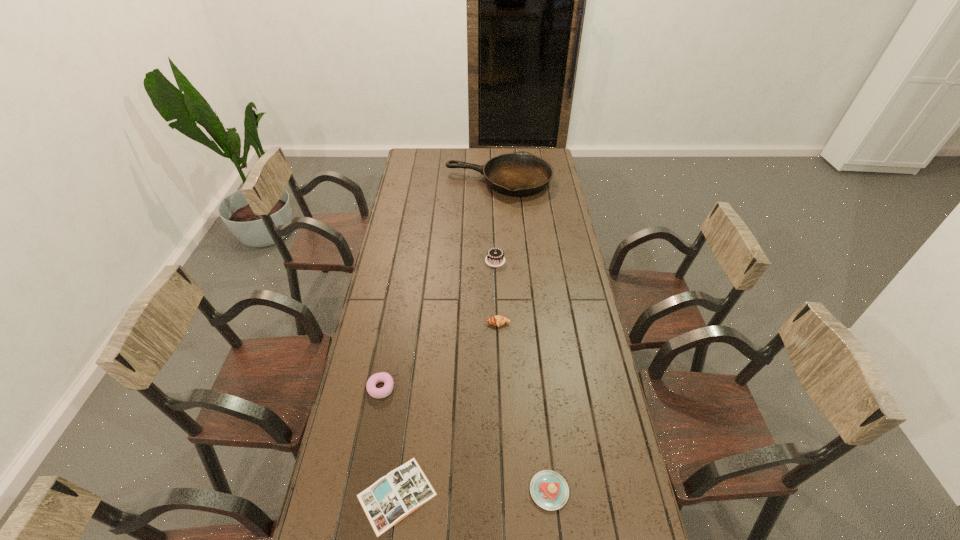
This screenshot has width=960, height=540. Find the location of `the farthest object`. the farthest object is located at coordinates (519, 174).

This screenshot has width=960, height=540. I want to click on the fifth nearest object, so click(x=495, y=257).

Locate an element on the screen. the second pastry from left to right is located at coordinates (497, 320).

You are a GUI agent. You are given a task and a screenshot of the screen. Output one action in this format:
    pyautogui.click(x=<x>, y=<y>)
    Task: Click on the farthest pastry
    Image resolution: width=960 pixels, height=540 pixels.
    Given the screenshot: What is the action you would take?
    pyautogui.click(x=497, y=320)

Find the location of a particular element. Image resolution: width=960 pixels, height=540 pixels. the third nearest object is located at coordinates tap(386, 390).

Where is `the second nearest pastry`? This screenshot has width=960, height=540. the second nearest pastry is located at coordinates (386, 390).

Locate an element on the screen. the rightmost pastry is located at coordinates (549, 490).

Find the location of `the shortest object`. the shortest object is located at coordinates (390, 499).

Image resolution: width=960 pixels, height=540 pixels. I want to click on vacant space located on the front of the farthest object, so click(502, 237).

Where is `vacant space situated 0.270m on the back of the fifth nearest object`? The width and height of the screenshot is (960, 540). vacant space situated 0.270m on the back of the fifth nearest object is located at coordinates (493, 217).